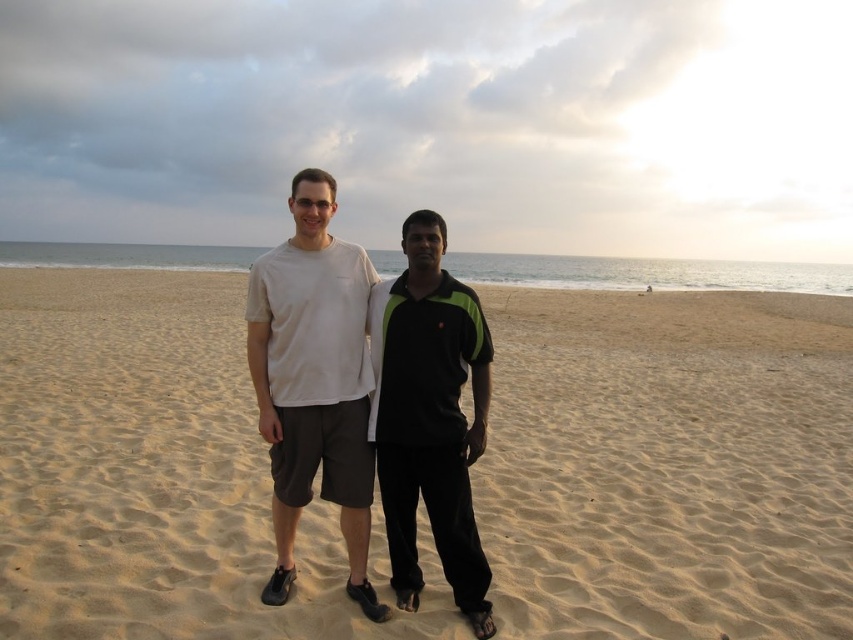
Question: Can you confirm if sandy yellow sand at center is positioned to the left of black matte shirt at center?

Choices:
 (A) yes
 (B) no

Answer: (A)

Question: Among these objects, which one is farthest from the camera?

Choices:
 (A) white matte t-shirt at center
 (B) black matte shirt at center
 (C) sandy yellow sand at center

Answer: (A)

Question: Does sandy yellow sand at center appear on the right side of black matte shirt at center?

Choices:
 (A) yes
 (B) no

Answer: (B)

Question: Which point is farther to the camera?

Choices:
 (A) sandy yellow sand at center
 (B) black matte shirt at center

Answer: (A)

Question: Which object is positioned farthest from the sandy yellow sand at center?

Choices:
 (A) black matte shirt at center
 (B) white matte t-shirt at center

Answer: (B)

Question: Considering the relative positions of sandy yellow sand at center and white matte t-shirt at center in the image provided, where is sandy yellow sand at center located with respect to white matte t-shirt at center?

Choices:
 (A) right
 (B) left

Answer: (B)